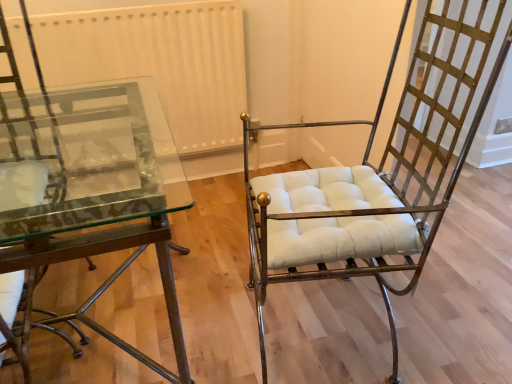
Question: From a real-world perspective, does gold textured metal chair at right, the first chair when ordered from right to left, sit lower than metallic glass table at left, which appears as the second chair when viewed from the right?

Choices:
 (A) yes
 (B) no

Answer: (B)

Question: Is metallic glass table at left, which appears as the second chair when viewed from the right, surrounded by gold textured metal chair at right, placed as the 2th chair when sorted from left to right?

Choices:
 (A) yes
 (B) no

Answer: (B)

Question: From the image's perspective, is gold textured metal chair at right, the first chair when ordered from right to left, beneath metallic glass table at left, which appears as the second chair when viewed from the right?

Choices:
 (A) yes
 (B) no

Answer: (B)

Question: From a real-world perspective, is gold textured metal chair at right, the first chair when ordered from right to left, located higher than metallic glass table at left, acting as the 1th chair starting from the left?

Choices:
 (A) no
 (B) yes

Answer: (B)

Question: Considering the relative positions of gold textured metal chair at right, the first chair when ordered from right to left, and metallic glass table at left, acting as the 1th chair starting from the left, in the image provided, is gold textured metal chair at right, the first chair when ordered from right to left, behind metallic glass table at left, acting as the 1th chair starting from the left,?

Choices:
 (A) no
 (B) yes

Answer: (B)

Question: Is gold textured metal chair at right, the first chair when ordered from right to left, smaller than metallic glass table at left, acting as the 1th chair starting from the left?

Choices:
 (A) no
 (B) yes

Answer: (A)

Question: From a real-world perspective, is white textured radiator at upper center beneath clear glass table at left?

Choices:
 (A) no
 (B) yes

Answer: (A)

Question: Is white textured radiator at upper center shorter than clear glass table at left?

Choices:
 (A) no
 (B) yes

Answer: (B)

Question: Considering the relative sizes of white textured radiator at upper center and clear glass table at left in the image provided, is white textured radiator at upper center bigger than clear glass table at left?

Choices:
 (A) yes
 (B) no

Answer: (B)

Question: Can you confirm if white textured radiator at upper center is wider than clear glass table at left?

Choices:
 (A) no
 (B) yes

Answer: (A)

Question: Can you confirm if white textured radiator at upper center is taller than clear glass table at left?

Choices:
 (A) no
 (B) yes

Answer: (A)

Question: Considering the relative positions of white textured radiator at upper center and clear glass table at left in the image provided, is white textured radiator at upper center to the right of clear glass table at left from the viewer's perspective?

Choices:
 (A) no
 (B) yes

Answer: (A)

Question: Would you consider clear glass table at left to be distant from metallic glass table at left, which appears as the second chair when viewed from the right?

Choices:
 (A) yes
 (B) no

Answer: (B)